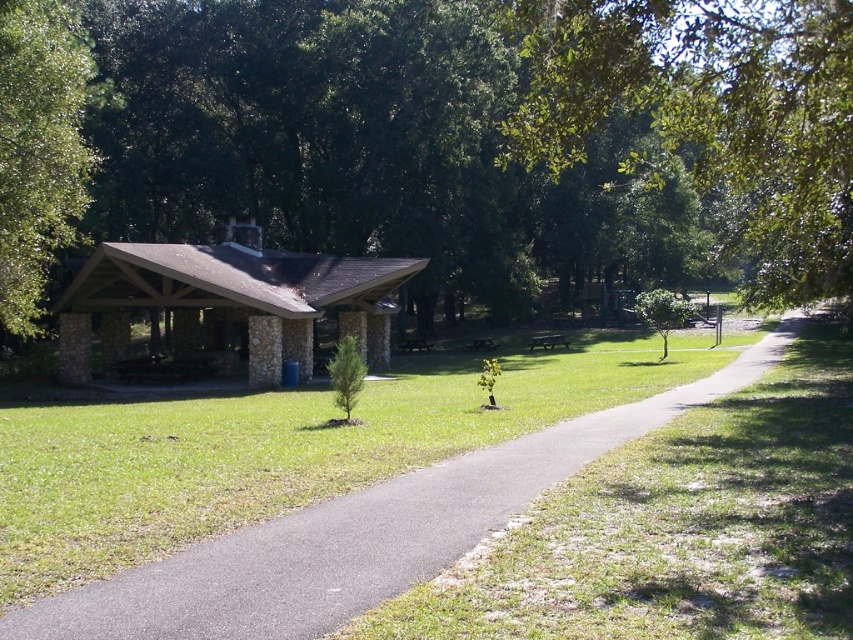
Question: Can you confirm if green leafy tree at center is positioned above brown stone hut at center?

Choices:
 (A) yes
 (B) no

Answer: (A)

Question: Among these objects, which one is nearest to the camera?

Choices:
 (A) metallic silver picnic table at center
 (B) green leafy tree at left
 (C) asphalt at center

Answer: (C)

Question: Is green leafy tree at upper right further to camera compared to metallic silver picnic table at center?

Choices:
 (A) yes
 (B) no

Answer: (B)

Question: Considering the real-world distances, which object is closest to the green leafy tree at upper right?

Choices:
 (A) green leafy tree at left
 (B) metallic silver picnic table at center
 (C) asphalt at center

Answer: (C)

Question: Which object appears closest to the camera in this image?

Choices:
 (A) green leafy tree at left
 (B) green leafy tree at upper right
 (C) green leafy tree at center

Answer: (B)

Question: Where is asphalt at center located in relation to brown stone hut at center in the image?

Choices:
 (A) above
 (B) below

Answer: (B)